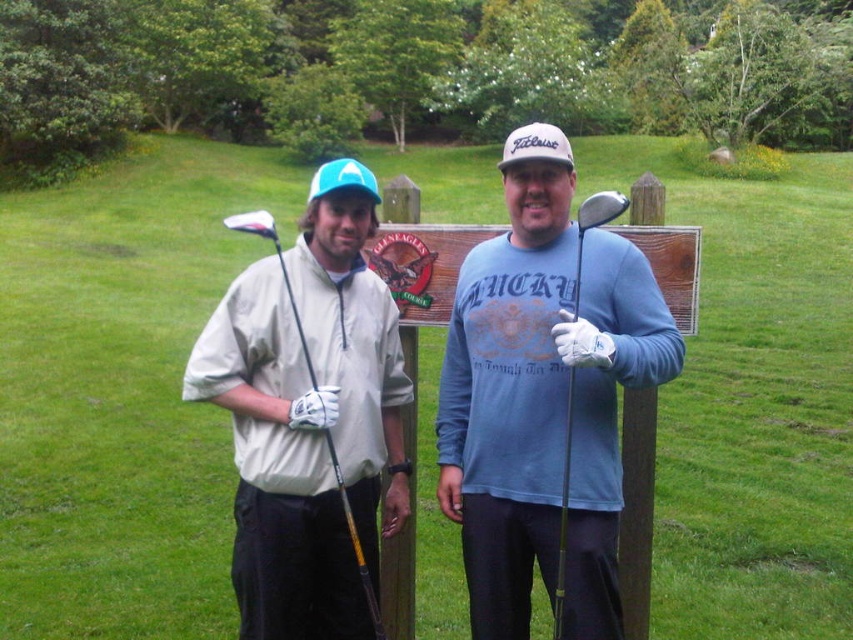
Question: Which point is farther from the camera taking this photo?

Choices:
 (A) (447, 474)
 (B) (579, 225)
 (C) (334, 449)

Answer: (A)

Question: Does matte blue shirt at center appear under matte black golf club at left?

Choices:
 (A) yes
 (B) no

Answer: (A)

Question: Which object appears farthest from the camera in this image?

Choices:
 (A) shiny silver golf club at center
 (B) matte black golf club at left
 (C) matte blue shirt at center

Answer: (B)

Question: Which of these objects is positioned closest to the matte blue shirt at center?

Choices:
 (A) shiny silver golf club at center
 (B) matte black golf club at left

Answer: (A)

Question: Considering the relative positions of matte blue shirt at center and matte black golf club at left in the image provided, where is matte blue shirt at center located with respect to matte black golf club at left?

Choices:
 (A) right
 (B) left

Answer: (A)

Question: Is shiny silver golf club at center to the right of matte black golf club at left from the viewer's perspective?

Choices:
 (A) no
 (B) yes

Answer: (B)